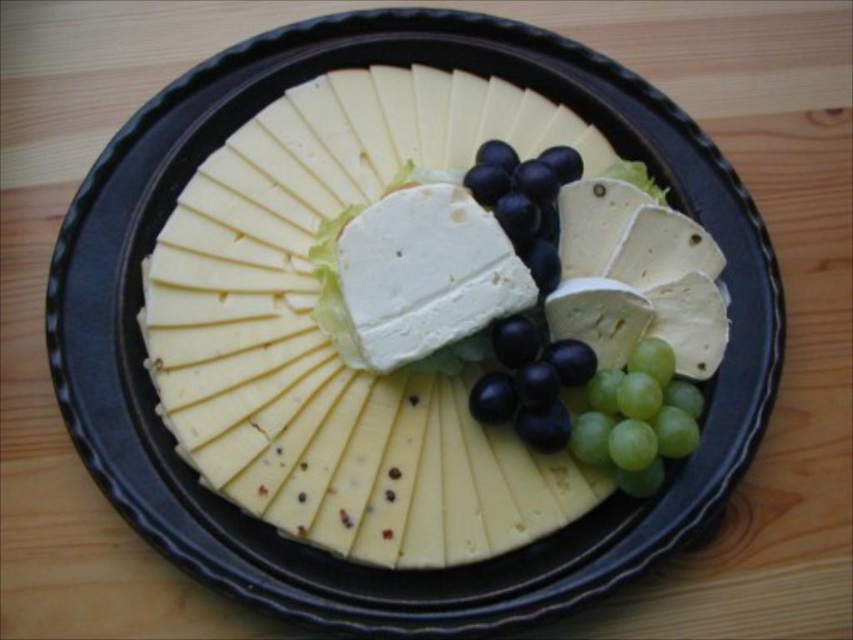
You are arranging a cheese platter and want to place both the green matte grapes at lower right and the purple glossy grapes at center. Based on their positions, which grapes are closer to you?

The green matte grapes at lower right are closer to you because they are positioned in front of the purple glossy grapes at center.

You are planning to serve a dessert and have both green matte grapes at lower right and black glossy grapes at center on your platter. Which grapes should you choose if you want the larger portion?

The green matte grapes at lower right are bigger than the black glossy grapes at center, so you should choose the green matte grapes at lower right for a larger portion.

You are planning to place a small decorative bowl on the cheese platter. The bowl is 10 cm in diameter. You want to place it in the area where there are grapes. Which grapes should you choose between the black glossy grapes at center and the purple glossy grapes at center to ensure the bowl fits?

The black glossy grapes at center occupies less space than purple glossy grapes at center, so placing the bowl where the black glossy grapes at center are would leave more space for the bowl to fit.